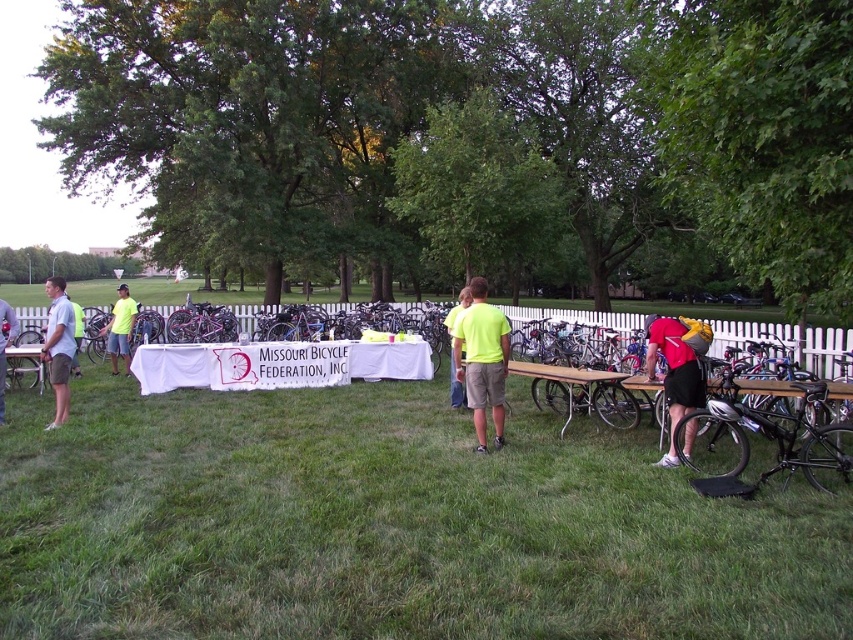
You are a photographer trying to capture a clear photo of the light gray shirt at left and the light gray shorts at center. Since you want both subjects to be in focus, you need to adjust your camera settings. Which subject should you focus on to ensure both are sharp?

You should focus on the light gray shirt at left because it might be wider than the light gray shorts at center, so focusing on the wider subject helps achieve better depth of field for both.